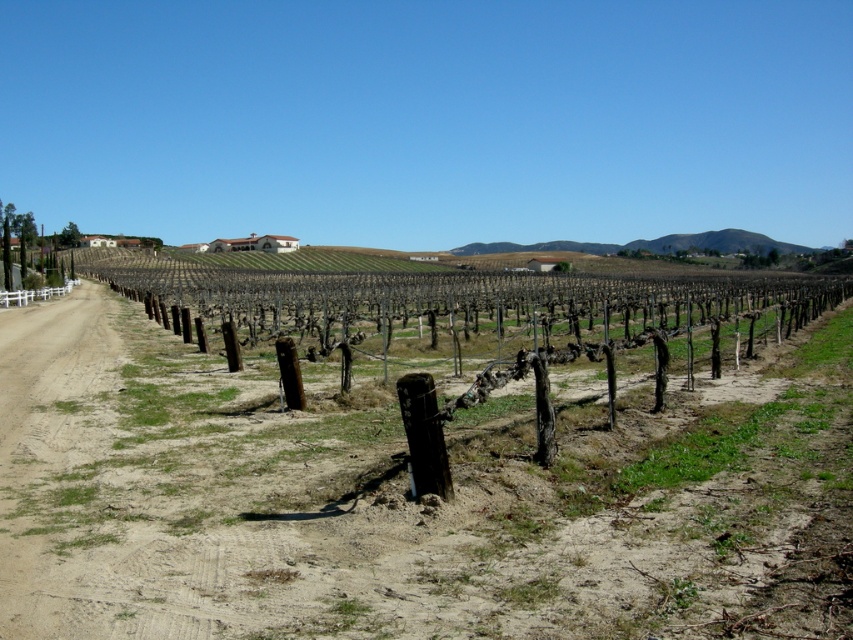
Question: Based on their relative distances, which object is farther from the brown wooden fence at center?

Choices:
 (A) brown dirt field at center
 (B) white plastic fence at left

Answer: (B)

Question: Is brown wooden fence at center thinner than white plastic fence at left?

Choices:
 (A) no
 (B) yes

Answer: (A)

Question: Is brown wooden fence at center to the left of white plastic fence at left from the viewer's perspective?

Choices:
 (A) no
 (B) yes

Answer: (A)

Question: Is brown dirt field at center closer to the viewer compared to brown wooden fence at center?

Choices:
 (A) yes
 (B) no

Answer: (A)

Question: Among these points, which one is nearest to the camera?

Choices:
 (A) (22, 301)
 (B) (511, 282)
 (C) (262, 589)

Answer: (C)

Question: Considering the real-world distances, which object is closest to the brown dirt field at center?

Choices:
 (A) white plastic fence at left
 (B) brown wooden fence at center

Answer: (B)